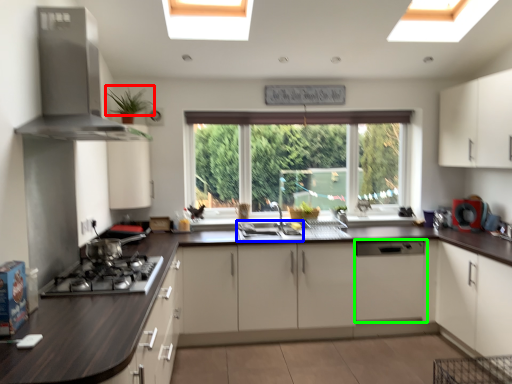
Question: Which is farther away from plant (highlighted by a red box)? sink (highlighted by a blue box) or cabinetry (highlighted by a green box)?

Choices:
 (A) sink
 (B) cabinetry

Answer: (B)